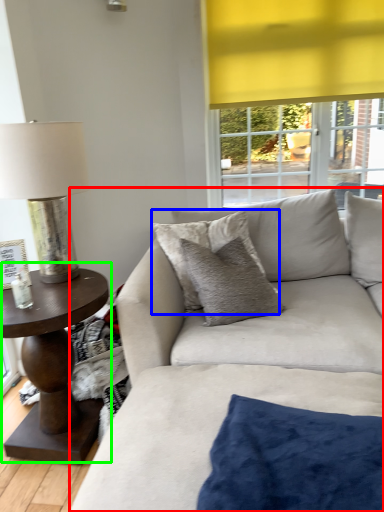
Question: Estimate the real-world distances between objects in this image. Which object is farther from studio couch (highlighted by a red box), pillow (highlighted by a blue box) or coffee table (highlighted by a green box)?

Choices:
 (A) pillow
 (B) coffee table

Answer: (B)